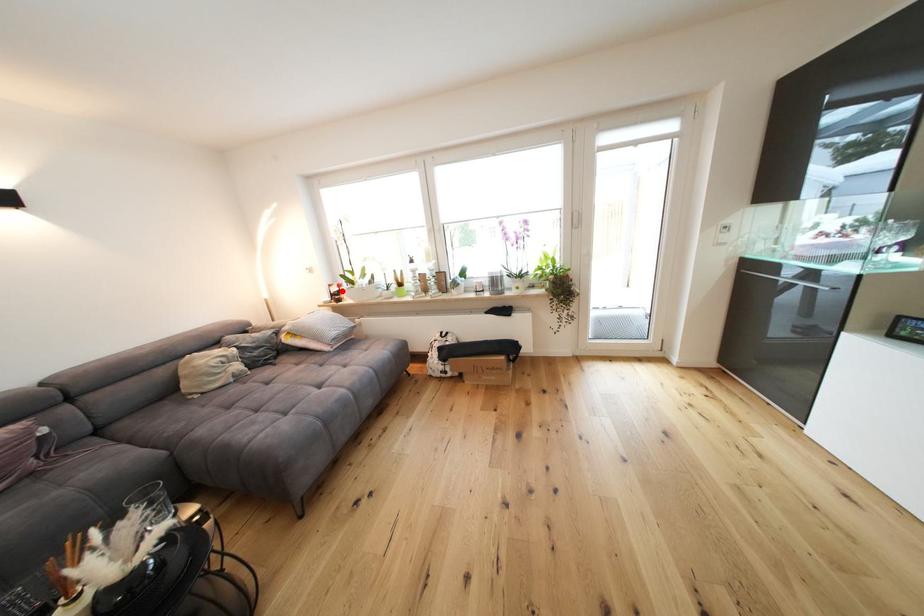
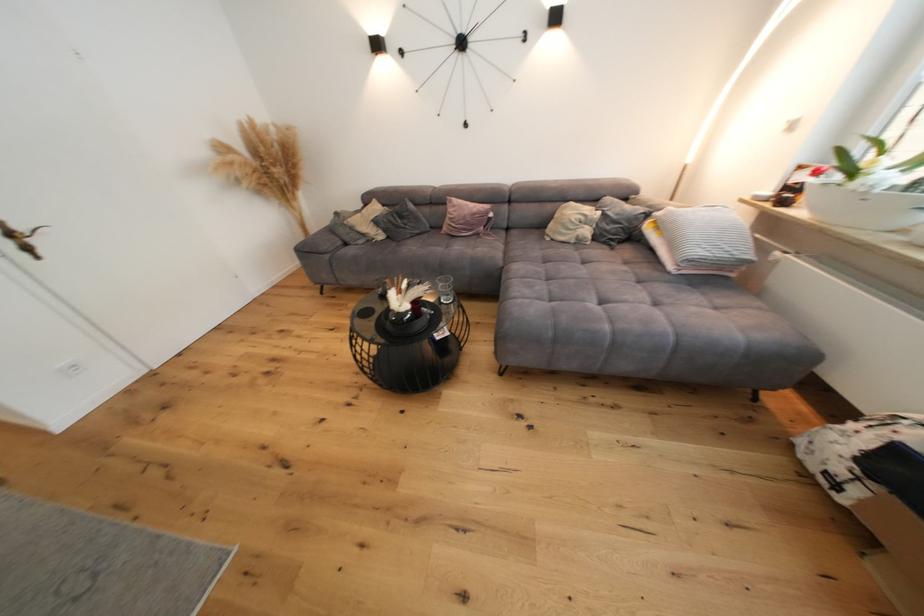
Question: A red point is marked in image1. In image2, is the corresponding 3D point closer to the camera or farther? Reply with the corresponding letter.

Choices:
 (A) The corresponding 3D point is closer.
 (B) The corresponding 3D point is farther.

Answer: (B)